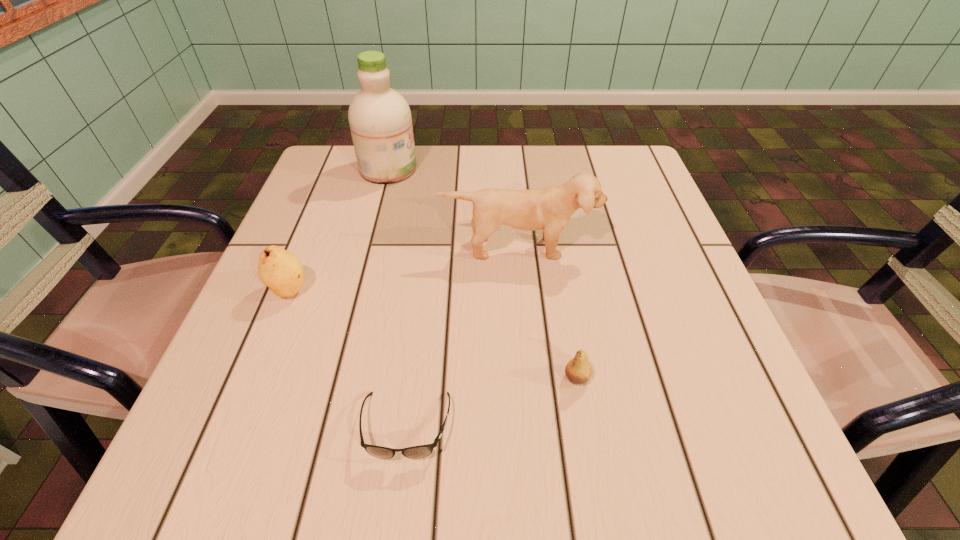
Find the location of a particular element. free spot at the near edge of the desktop is located at coordinates (332, 427).

This screenshot has width=960, height=540. In the image, there is a desktop. What are the coordinates of `vacant space at the left edge` in the screenshot? It's located at (266, 396).

Identify the location of blank space at the right edge. This screenshot has height=540, width=960. (612, 215).

The width and height of the screenshot is (960, 540). Identify the location of free location at the near left corner. (293, 443).

Image resolution: width=960 pixels, height=540 pixels. Identify the location of free space at the far right corner of the desktop. (629, 194).

Find the location of `vacant space that's between the shortest object and the puppy`. vacant space that's between the shortest object and the puppy is located at coordinates (462, 337).

This screenshot has height=540, width=960. Find the location of `vacant space that is in between the nearer pear and the puppy`. vacant space that is in between the nearer pear and the puppy is located at coordinates (547, 313).

What are the coordinates of `free space between the farthest object and the second tallest object` in the screenshot? It's located at (453, 208).

You are a GUI agent. You are given a task and a screenshot of the screen. Output one action in this format:
    pyautogui.click(x=<x>, y=<y>)
    Task: Click on the empty space between the farthest object and the fourth nearest object
    The height and width of the screenshot is (540, 960).
    Given the screenshot: What is the action you would take?
    pyautogui.click(x=453, y=208)

The height and width of the screenshot is (540, 960). I want to click on free space that is in between the second tallest object and the left pear, so click(403, 269).